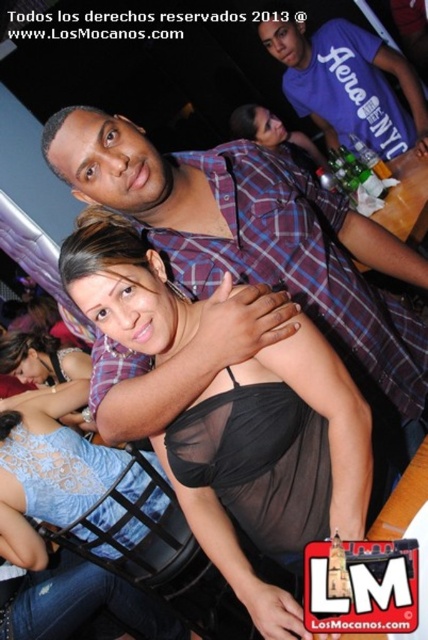
Can you confirm if plaid shirt at center is shorter than purple cotton t-shirt at upper right?

Yes.

Between plaid shirt at center and purple cotton t-shirt at upper right, which one has more height?

purple cotton t-shirt at upper right is taller.

I want to click on plaid shirt at center, so click(x=241, y=266).

Which of these two, black sheer dress at center or purple cotton t-shirt at upper right, stands taller?

purple cotton t-shirt at upper right

What do you see at coordinates (275, 465) in the screenshot? The width and height of the screenshot is (428, 640). I see `black sheer dress at center` at bounding box center [275, 465].

Where is `black sheer dress at center`? This screenshot has height=640, width=428. black sheer dress at center is located at coordinates (275, 465).

Locate an element on the screen. Image resolution: width=428 pixels, height=640 pixels. black sheer dress at center is located at coordinates click(x=275, y=465).

Who is higher up, plaid shirt at center or black sheer dress at center?

plaid shirt at center is above.

Is plaid shirt at center above black sheer dress at center?

Yes.

Who is more distant from viewer, (362, 298) or (309, 356)?

The point (362, 298) is behind.

This screenshot has width=428, height=640. Identify the location of plaid shirt at center. (241, 266).